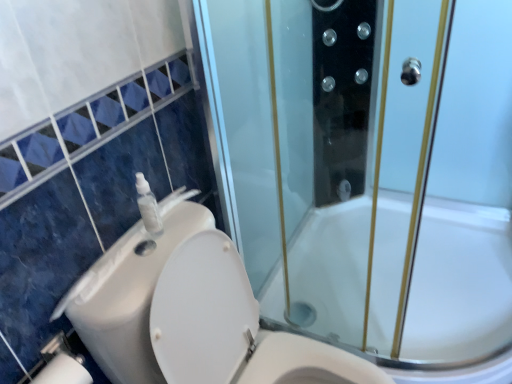
Question: In terms of height, does transparent plastic soap dispenser at upper left look taller or shorter compared to white plastic sink at left?

Choices:
 (A) tall
 (B) short

Answer: (A)

Question: From a real-world perspective, is transparent plastic soap dispenser at upper left above or below white plastic sink at left?

Choices:
 (A) below
 (B) above

Answer: (B)

Question: Based on their relative distances, which object is farther from the transparent plastic soap dispenser at upper left?

Choices:
 (A) white plastic sink at left
 (B) transparent glass shower door at center
 (C) white plastic toilet at lower left

Answer: (B)

Question: Estimate the real-world distances between objects in this image. Which object is farther from the white plastic toilet at lower left?

Choices:
 (A) transparent plastic soap dispenser at upper left
 (B) transparent glass shower door at center
 (C) white plastic sink at left

Answer: (B)